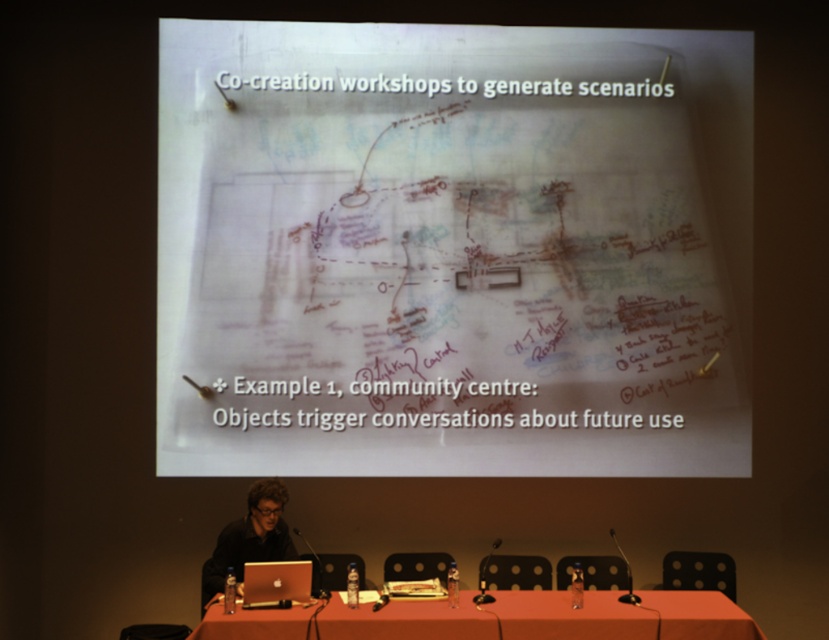
You are organizing a presentation and need to place a 15 cm wide projector remote on the table. Can the smooth orange table at center accommodate the silver metallic laptop at center and the remote without overlapping?

The smooth orange table at center might be wider than silver metallic laptop at center, so there is a possibility that both items can fit without overlapping. However, the exact dimensions are not provided, so it is uncertain.

Based on the scene described, if you were to place a new object between the white paper at upper center and the silver metallic laptop at center, where would it logically be positioned relative to the laptop?

The new object would be placed above the silver metallic laptop at center since the white paper at upper center is already positioned above it.